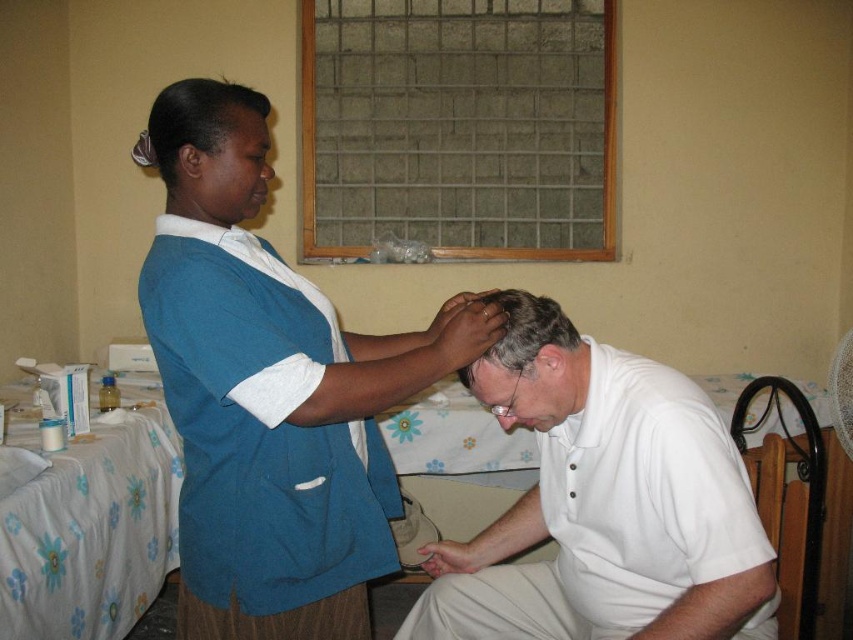
Does matte blue uniform at upper left have a greater width compared to smooth skin forehead at center?

Indeed, matte blue uniform at upper left has a greater width compared to smooth skin forehead at center.

Is the position of matte blue uniform at upper left less distant than that of smooth skin forehead at center?

Yes, it is.

At what (x,y) coordinates should I click in order to perform the action: click on matte blue uniform at upper left. Please return your answer as a coordinate pair (x, y). Looking at the image, I should click on (209, 148).

This screenshot has height=640, width=853. In order to click on matte blue uniform at upper left in this screenshot , I will do `click(209, 148)`.

Which is in front, point (570, 580) or point (259, 129)?

Point (259, 129) is more forward.

Identify the location of white matte shirt at center. (605, 506).

Locate an element on the screen. This screenshot has width=853, height=640. white matte shirt at center is located at coordinates (605, 506).

Is point (155, 285) positioned before point (492, 392)?

Yes, point (155, 285) is in front of point (492, 392).

Image resolution: width=853 pixels, height=640 pixels. I want to click on teal fabric uniform at center, so click(271, 390).

You are a GUI agent. You are given a task and a screenshot of the screen. Output one action in this format:
    pyautogui.click(x=<x>, y=<y>)
    Task: Click on the teal fabric uniform at center
    
    Given the screenshot: What is the action you would take?
    pyautogui.click(x=271, y=390)